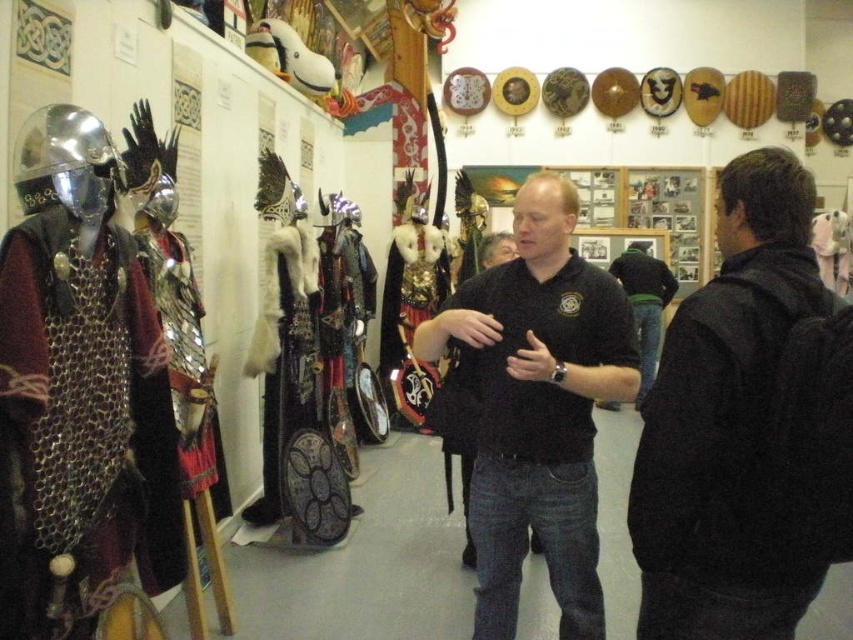
Question: Which point is closer to the camera taking this photo?

Choices:
 (A) (740, 388)
 (B) (132, 499)
 (C) (537, 253)

Answer: (A)

Question: In this image, where is black matte shirt at center located relative to black matte polo shirt at center?

Choices:
 (A) below
 (B) above

Answer: (A)

Question: Among these points, which one is farthest from the camera?

Choices:
 (A) (583, 582)
 (B) (9, 285)
 (C) (646, 536)
 (D) (624, 304)

Answer: (D)

Question: In this image, where is dark gray fleece jacket at right located relative to black matte polo shirt at center?

Choices:
 (A) left
 (B) right

Answer: (B)

Question: Which point is farther to the camera?

Choices:
 (A) dark gray fleece jacket at right
 (B) black matte polo shirt at center

Answer: (B)

Question: Can you confirm if black matte shirt at center is thinner than black matte polo shirt at center?

Choices:
 (A) no
 (B) yes

Answer: (A)